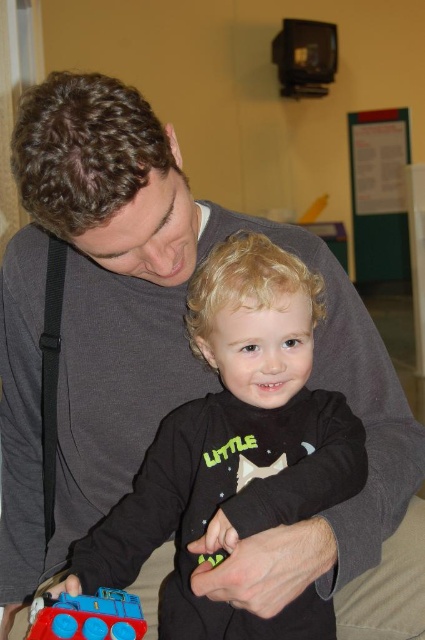
Question: Which point appears closest to the camera in this image?

Choices:
 (A) (206, 323)
 (B) (36, 637)

Answer: (B)

Question: Is black matte shirt at center further to camera compared to rubberized blue train at lower left?

Choices:
 (A) no
 (B) yes

Answer: (B)

Question: Among these points, which one is nearest to the camera?

Choices:
 (A) (x=70, y=605)
 (B) (x=316, y=461)

Answer: (A)

Question: Is black matte shirt at center thinner than rubberized blue train at lower left?

Choices:
 (A) yes
 (B) no

Answer: (B)

Question: Can you confirm if black matte shirt at center is bigger than rubberized blue train at lower left?

Choices:
 (A) yes
 (B) no

Answer: (A)